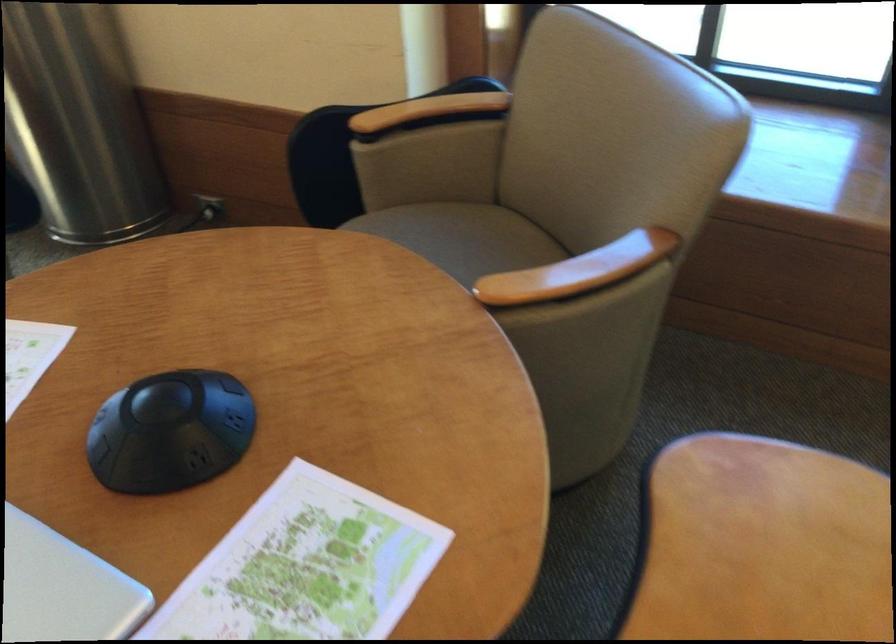
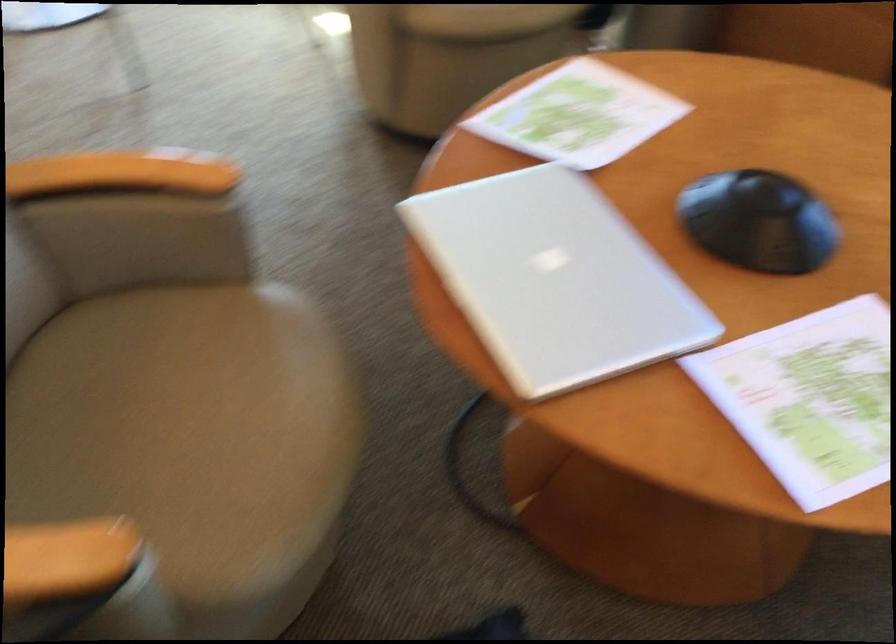
Question: The camera is either moving clockwise (left) or counter-clockwise (right) around the object. The first image is from the beginning of the video and the second image is from the end. Is the camera moving left or right when shooting the video?

Choices:
 (A) Left
 (B) Right

Answer: (B)